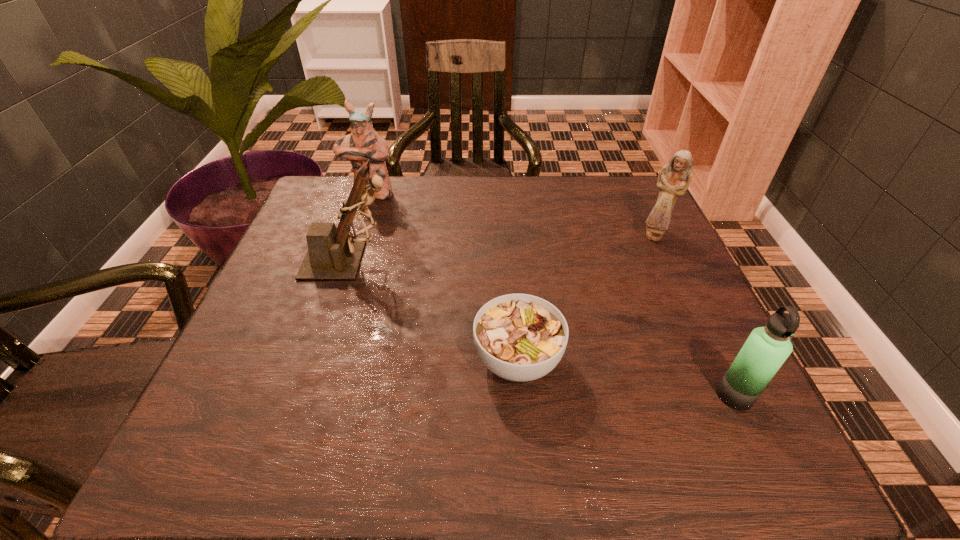
The image size is (960, 540). I want to click on the farthest object, so click(364, 143).

Find the location of a particular element. the rightmost figurine is located at coordinates (x=674, y=178).

This screenshot has width=960, height=540. In order to click on thermos bottle in this screenshot , I will do point(766,349).

Identify the location of soup bowl. (519, 337).

Locate an element on the screen. the shortest object is located at coordinates (519, 337).

Find the location of a particular element. free spot located 0.390m on the front-facing side of the farthest object is located at coordinates (333, 309).

Image resolution: width=960 pixels, height=540 pixels. What are the coordinates of `free space located on the front-facing side of the rightmost figurine` in the screenshot? It's located at (670, 268).

In order to click on vacant space located 0.160m on the back of the thermos bottle in this screenshot , I will do `click(695, 314)`.

Identify the location of free location located 0.210m on the left of the shortest object. point(359,360).

This screenshot has height=540, width=960. In order to click on figurine present at the right edge in this screenshot , I will do `click(674, 178)`.